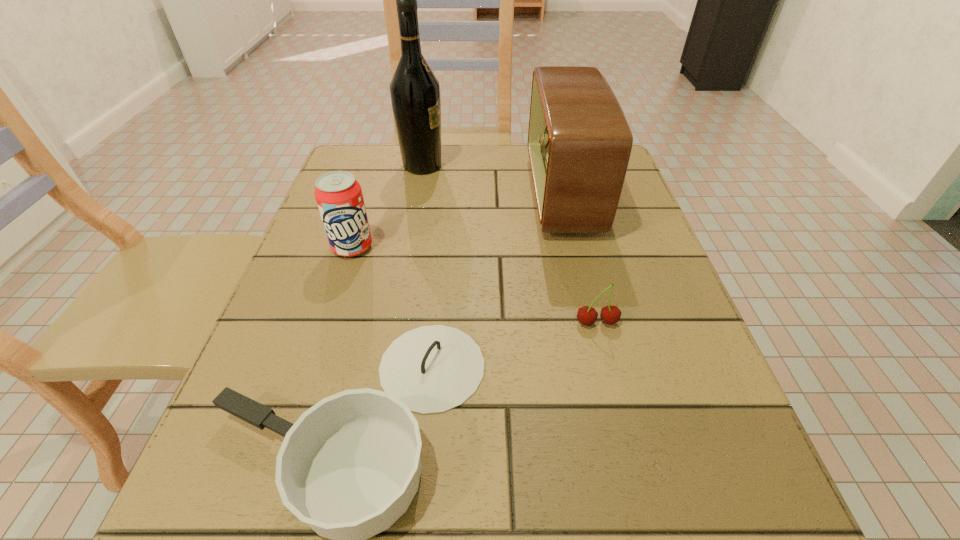
I want to click on wine bottle situated at the far edge, so click(415, 92).

I want to click on radio receiver that is positioned at the far edge, so pos(579,142).

Locate an element on the screen. This screenshot has width=960, height=540. wine bottle that is positioned at the left edge is located at coordinates (415, 92).

Locate an element on the screen. The image size is (960, 540). soda can that is positioned at the left edge is located at coordinates (338, 194).

I want to click on radio receiver at the right edge, so click(x=579, y=142).

The height and width of the screenshot is (540, 960). What are the coordinates of `cherry located at the right edge` in the screenshot? It's located at (586, 315).

Where is `object that is at the far left corner`? object that is at the far left corner is located at coordinates (415, 92).

Identify the location of object that is at the far right corner. Image resolution: width=960 pixels, height=540 pixels. (579, 142).

The height and width of the screenshot is (540, 960). In order to click on vacant position at the far edge of the desktop in this screenshot , I will do `click(465, 146)`.

Where is `free space at the near edge of the desktop`? The height and width of the screenshot is (540, 960). free space at the near edge of the desktop is located at coordinates (561, 519).